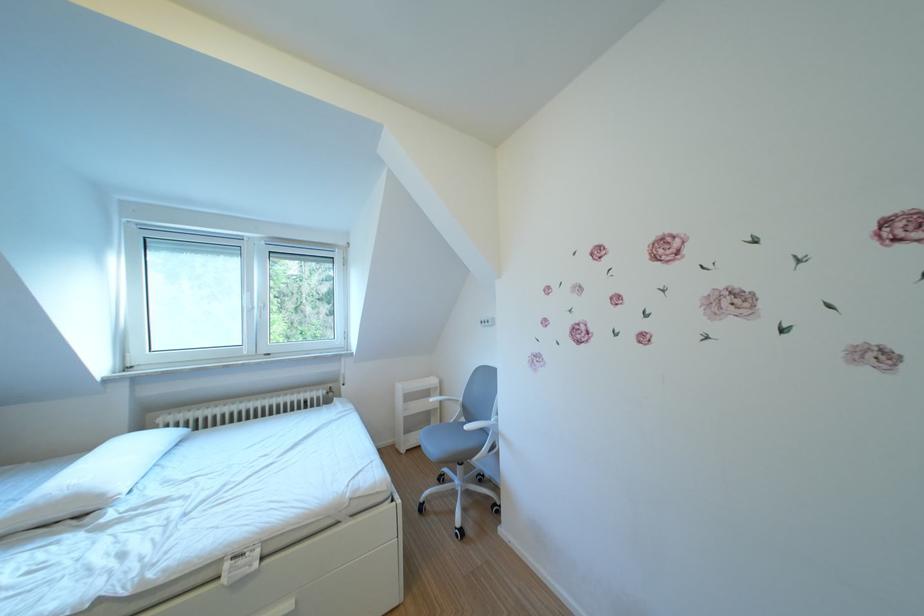
At what (x,y) coordinates should I click in order to perform the action: click on grey chair sitting surface. Please return your answer as a coordinate pair (x, y). Looking at the image, I should click on (438, 444).